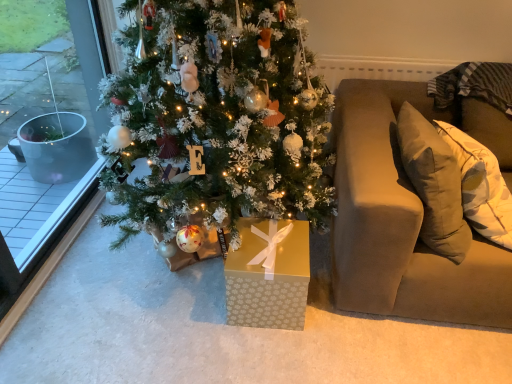
Question: Considering the relative sizes of white frosted christmas tree at center and gold paper gift box at center in the image provided, is white frosted christmas tree at center thinner than gold paper gift box at center?

Choices:
 (A) yes
 (B) no

Answer: (B)

Question: Can you confirm if white frosted christmas tree at center is bigger than gold paper gift box at center?

Choices:
 (A) yes
 (B) no

Answer: (A)

Question: Are white frosted christmas tree at center and gold paper gift box at center making contact?

Choices:
 (A) yes
 (B) no

Answer: (B)

Question: Is white frosted christmas tree at center facing away from gold paper gift box at center?

Choices:
 (A) no
 (B) yes

Answer: (A)

Question: From the image's perspective, is white frosted christmas tree at center over gold paper gift box at center?

Choices:
 (A) yes
 (B) no

Answer: (A)

Question: Is white frosted christmas tree at center not inside gold paper gift box at center?

Choices:
 (A) yes
 (B) no

Answer: (A)

Question: Is beige fabric couch at right taller than gold paper gift box at center?

Choices:
 (A) yes
 (B) no

Answer: (A)

Question: Is beige fabric couch at right to the left of gold paper gift box at center from the viewer's perspective?

Choices:
 (A) yes
 (B) no

Answer: (B)

Question: Does beige fabric couch at right appear on the right side of gold paper gift box at center?

Choices:
 (A) no
 (B) yes

Answer: (B)

Question: Is gold paper gift box at center at the back of beige fabric couch at right?

Choices:
 (A) no
 (B) yes

Answer: (A)

Question: Is beige fabric couch at right oriented towards gold paper gift box at center?

Choices:
 (A) yes
 (B) no

Answer: (B)

Question: Is gold paper gift box at center completely or partially inside beige fabric couch at right?

Choices:
 (A) no
 (B) yes

Answer: (A)

Question: From the image's perspective, does white frosted christmas tree at center appear higher than beige fabric couch at right?

Choices:
 (A) yes
 (B) no

Answer: (A)